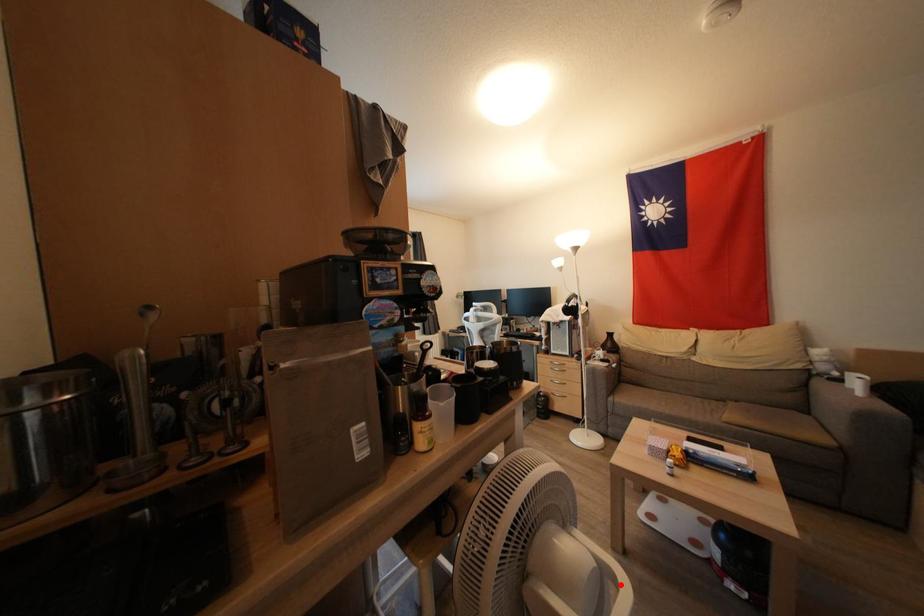
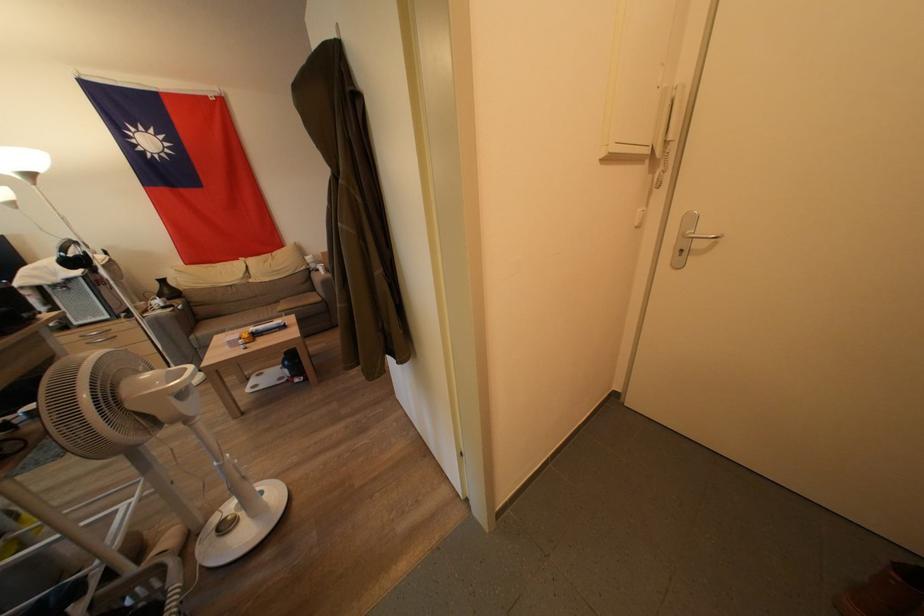
In the second image, find the point that corresponds to the highlighted location in the first image.

(190, 373)